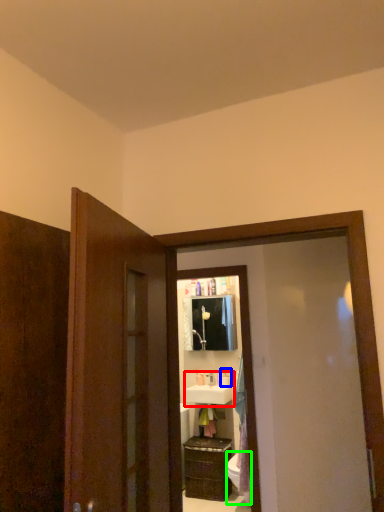
Question: Which is farther away from sink (highlighted by a red box)? toiletry (highlighted by a blue box) or toilet bowl (highlighted by a green box)?

Choices:
 (A) toiletry
 (B) toilet bowl

Answer: (B)